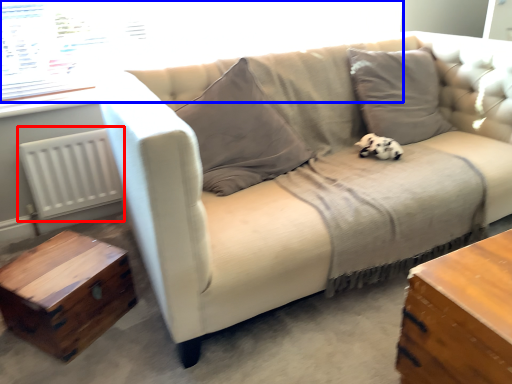
Question: Among these objects, which one is farthest to the camera, radiator (highlighted by a red box) or window screen (highlighted by a blue box)?

Choices:
 (A) radiator
 (B) window screen

Answer: (A)